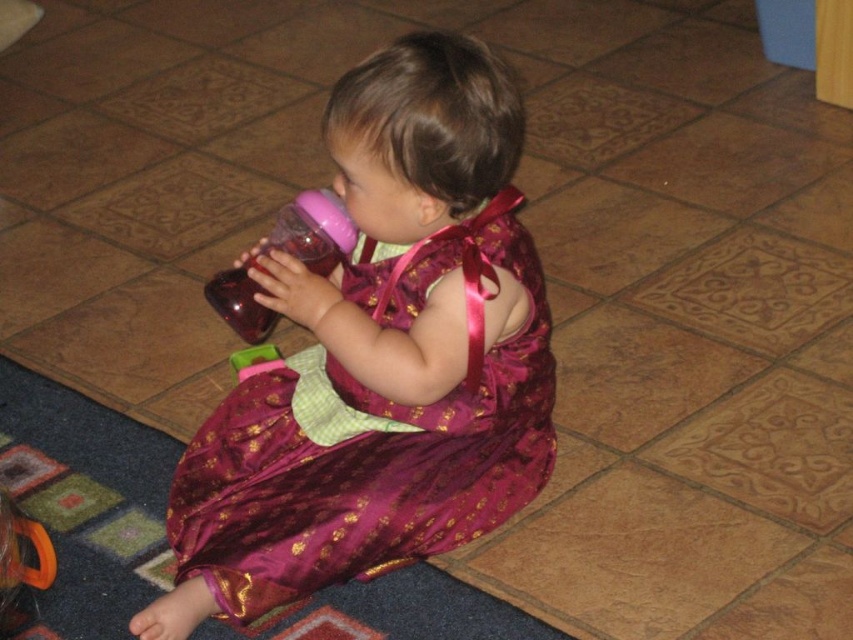
Question: Which point is closer to the camera?

Choices:
 (A) (482, 410)
 (B) (297, 214)

Answer: (B)

Question: Is shiny purple dress at center to the left of pink plastic bottle at center from the viewer's perspective?

Choices:
 (A) no
 (B) yes

Answer: (A)

Question: Can you confirm if shiny purple dress at center is positioned to the left of pink plastic bottle at center?

Choices:
 (A) yes
 (B) no

Answer: (B)

Question: From the image, what is the correct spatial relationship of shiny purple dress at center in relation to pink plastic bottle at center?

Choices:
 (A) below
 (B) above

Answer: (A)